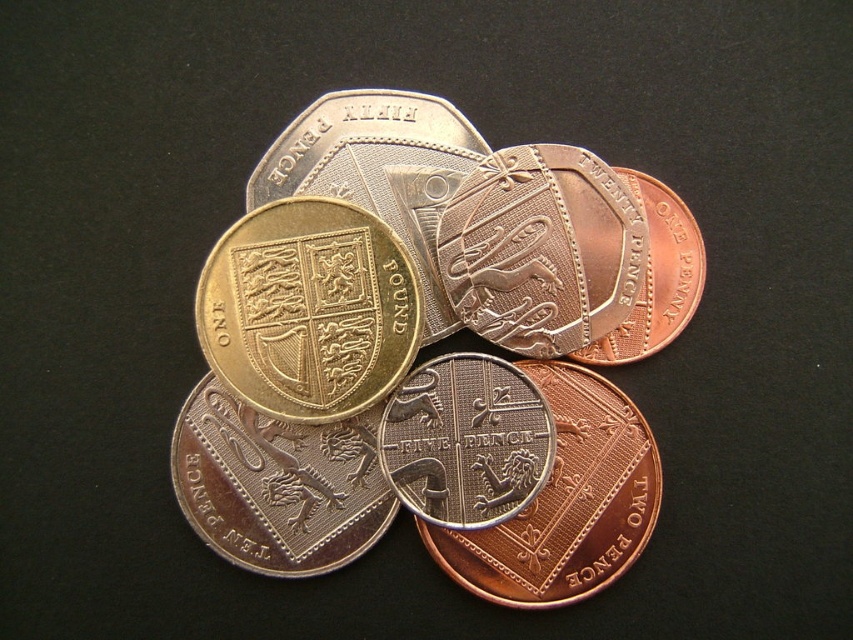
Question: Does brass-like metallic coin at center appear under silver textured five pence at center?

Choices:
 (A) yes
 (B) no

Answer: (A)

Question: Estimate the real-world distances between objects in this image. Which object is closer to the gold-plated coin at center?

Choices:
 (A) brass-like metallic five pence at center
 (B) shiny silver coin at center
 (C) silver textured five pence at center
 (D) brass-like metallic coin at center

Answer: (D)

Question: Based on their relative distances, which object is nearer to the silver textured five pence at center?

Choices:
 (A) gold-plated coin at center
 (B) brass-like metallic coin at center
 (C) shiny silver coin at center
 (D) brass-like metallic five pence at center

Answer: (D)

Question: Is gold-plated coin at center smaller than brass-like metallic five pence at center?

Choices:
 (A) no
 (B) yes

Answer: (B)

Question: Can you confirm if brass-like metallic coin at center is positioned to the left of silver textured five pence at center?

Choices:
 (A) no
 (B) yes

Answer: (B)

Question: Among these points, which one is farthest from the camera?

Choices:
 (A) (234, 554)
 (B) (496, 451)
 (C) (276, 266)
 (D) (525, 310)

Answer: (D)